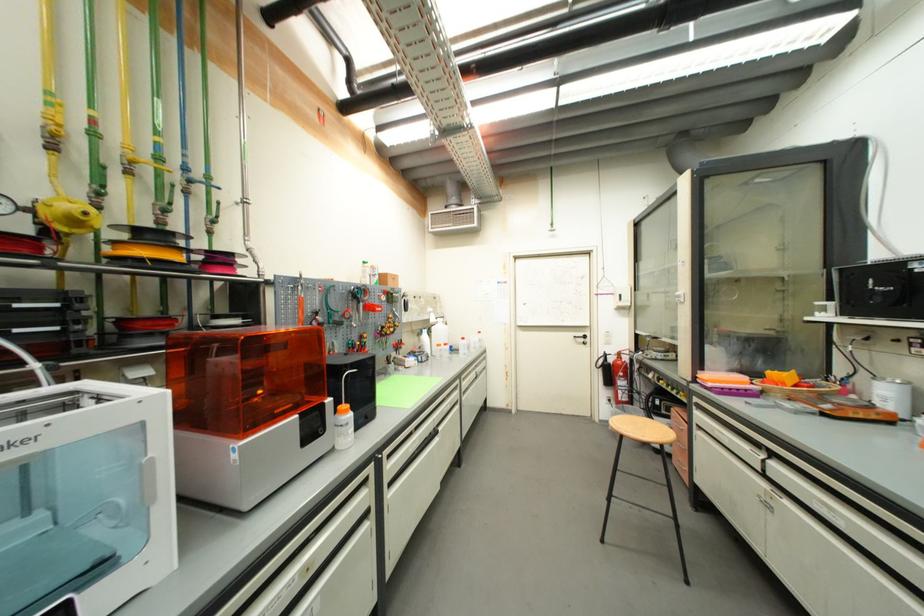
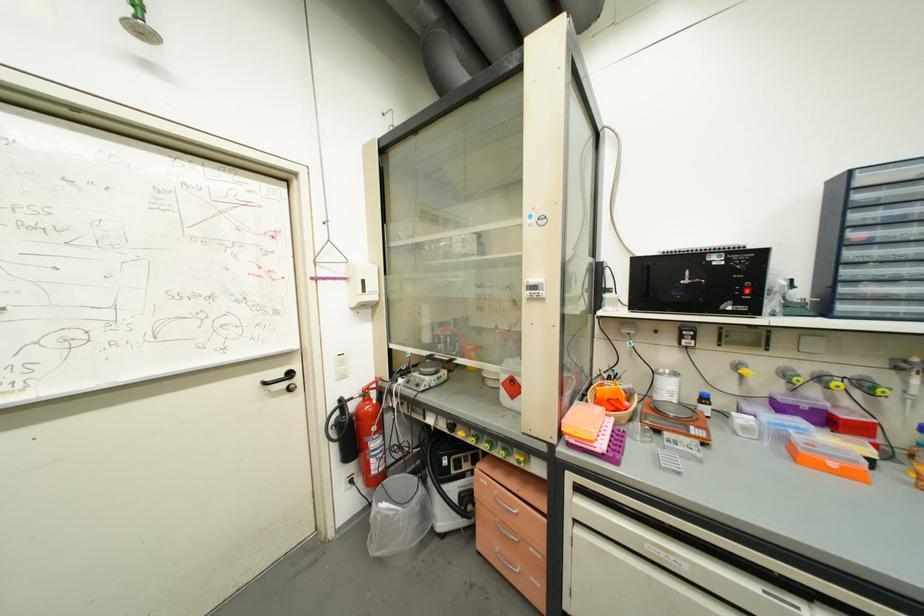
In the second image, find the point that corresponds to (616,361) in the first image.

(358, 408)